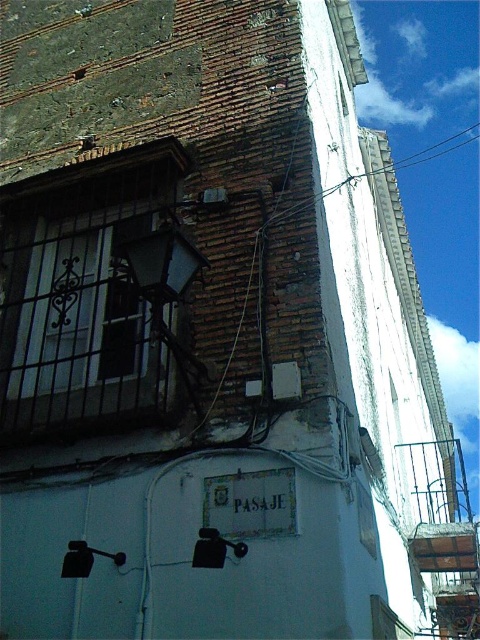
Who is positioned more to the left, brown wire at center or white plastic power line at upper center?

white plastic power line at upper center

Locate an element on the screen. brown wire at center is located at coordinates (385, 244).

Locate an element on the screen. The height and width of the screenshot is (640, 480). brown wire at center is located at coordinates (385, 244).